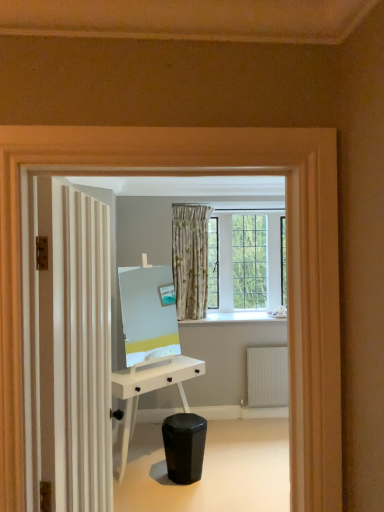
Question: From a real-world perspective, is white matte desk at center below black matte swivel chair at lower center?

Choices:
 (A) no
 (B) yes

Answer: (A)

Question: Is white matte desk at center far from black matte swivel chair at lower center?

Choices:
 (A) no
 (B) yes

Answer: (A)

Question: Considering the relative sizes of white matte desk at center and black matte swivel chair at lower center in the image provided, is white matte desk at center smaller than black matte swivel chair at lower center?

Choices:
 (A) no
 (B) yes

Answer: (A)

Question: Can you confirm if white matte desk at center is positioned to the left of black matte swivel chair at lower center?

Choices:
 (A) yes
 (B) no

Answer: (A)

Question: Does white matte desk at center come behind black matte swivel chair at lower center?

Choices:
 (A) yes
 (B) no

Answer: (A)

Question: Is white matte desk at center closer to camera compared to black matte swivel chair at lower center?

Choices:
 (A) no
 (B) yes

Answer: (A)

Question: Could white textured door at left be considered to be inside white matte desk at center?

Choices:
 (A) no
 (B) yes

Answer: (A)

Question: Is white matte desk at center not inside white textured door at left?

Choices:
 (A) no
 (B) yes

Answer: (B)

Question: Is white matte desk at center oriented away from white textured door at left?

Choices:
 (A) no
 (B) yes

Answer: (A)

Question: Can you confirm if white matte desk at center is bigger than white textured door at left?

Choices:
 (A) no
 (B) yes

Answer: (B)

Question: Is white matte desk at center beside white textured door at left?

Choices:
 (A) no
 (B) yes

Answer: (A)

Question: Is white matte desk at center further to the viewer compared to white textured door at left?

Choices:
 (A) no
 (B) yes

Answer: (B)

Question: Is black matte swivel chair at lower center with white matte desk at center?

Choices:
 (A) no
 (B) yes

Answer: (A)